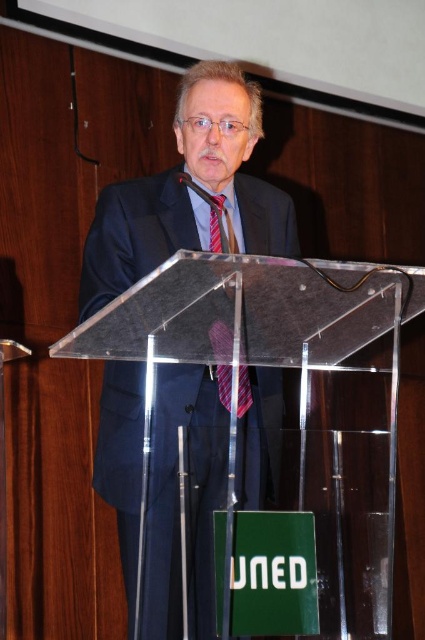
Does dark blue suit at center have a lesser width compared to red striped tie at center?

No, dark blue suit at center is not thinner than red striped tie at center.

Does dark blue suit at center have a smaller size compared to red striped tie at center?

Incorrect, dark blue suit at center is not smaller in size than red striped tie at center.

The image size is (425, 640). What are the coordinates of `dark blue suit at center` in the screenshot? It's located at (189, 493).